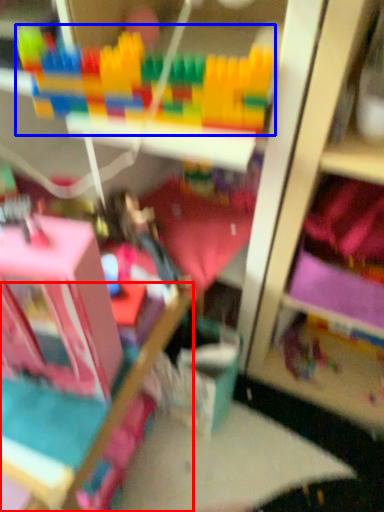
Question: Which object is closer to the camera taking this photo, bed frame (highlighted by a red box) or toy (highlighted by a blue box)?

Choices:
 (A) bed frame
 (B) toy

Answer: (B)